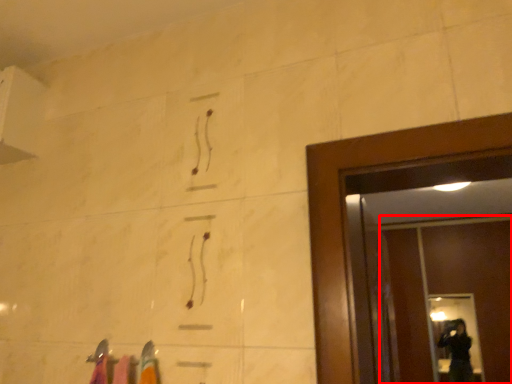
Question: Observing the image, what is the correct spatial positioning of screen door (annotated by the red box) in reference to glass door?

Choices:
 (A) right
 (B) left

Answer: (A)